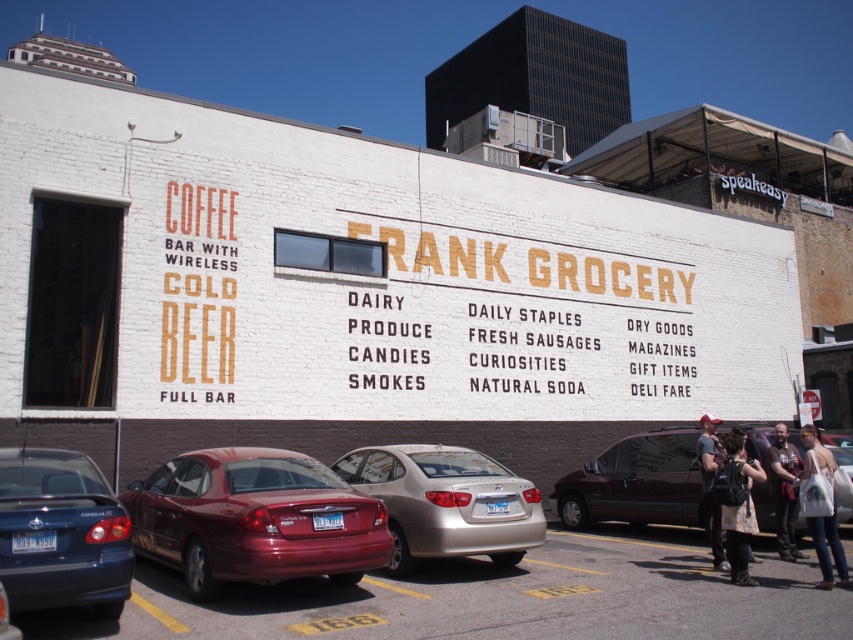
Question: Which point is closer to the camera?

Choices:
 (A) white fabric bag at lower right
 (B) matte blue sedan at lower left
 (C) patterned fabric dress at lower right
 (D) dark gray t-shirt at lower right

Answer: (B)

Question: Considering the relative positions of shiny red sedan at center and dark brown leather jacket at lower right in the image provided, where is shiny red sedan at center located with respect to dark brown leather jacket at lower right?

Choices:
 (A) right
 (B) left

Answer: (B)

Question: Is maroon matte van at lower right wider than dark gray t-shirt at lower right?

Choices:
 (A) yes
 (B) no

Answer: (B)

Question: Which of the following is the closest to the observer?

Choices:
 (A) (573, 486)
 (B) (120, 540)
 (C) (836, 552)
 (D) (786, 540)

Answer: (B)

Question: Can you confirm if silver metallic sedan at center is wider than white fabric bag at lower right?

Choices:
 (A) yes
 (B) no

Answer: (A)

Question: Which object is positioned closest to the dark brown leather jacket at lower right?

Choices:
 (A) silver metallic sedan at center
 (B) white fabric bag at lower right
 (C) dark gray t-shirt at lower right
 (D) maroon matte van at lower right

Answer: (C)